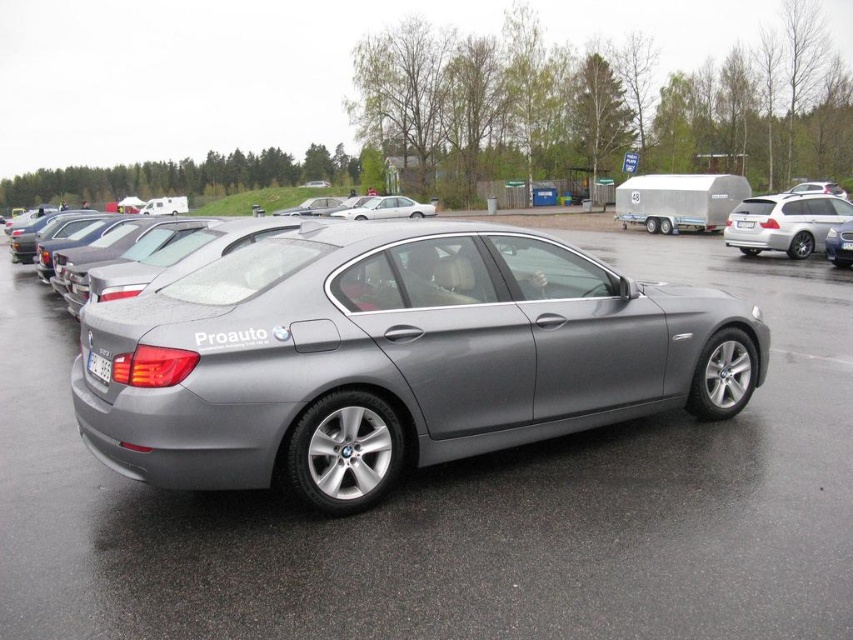
Question: Does satin silver sedan at right appear on the right side of satin silver sedan at center?

Choices:
 (A) no
 (B) yes

Answer: (B)

Question: Can you confirm if white glossy sedan at center is bigger than white plastic license plate at center?

Choices:
 (A) no
 (B) yes

Answer: (B)

Question: Where is satin metallic car at center located in relation to satin silver sedan at right in the image?

Choices:
 (A) right
 (B) left

Answer: (B)

Question: Which object appears farthest from the camera in this image?

Choices:
 (A) satin silver sedan at center
 (B) silver metallic sedan at center

Answer: (B)

Question: Which object is the farthest from the white plastic license plate at center?

Choices:
 (A) satin silver sedan at right
 (B) satin silver sedan at center

Answer: (B)

Question: Which point is farther to the camera?

Choices:
 (A) (834, 205)
 (B) (834, 236)

Answer: (A)